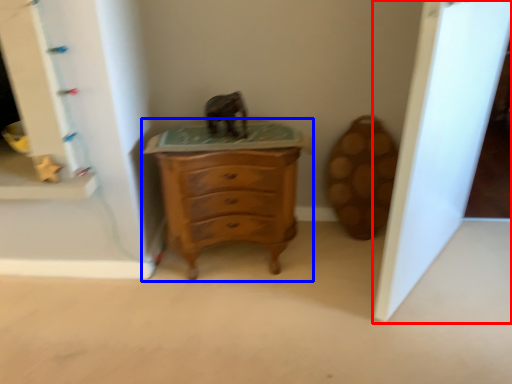
Question: Which object appears farthest to the camera in this image, glass door (highlighted by a red box) or chest of drawers (highlighted by a blue box)?

Choices:
 (A) glass door
 (B) chest of drawers

Answer: (B)